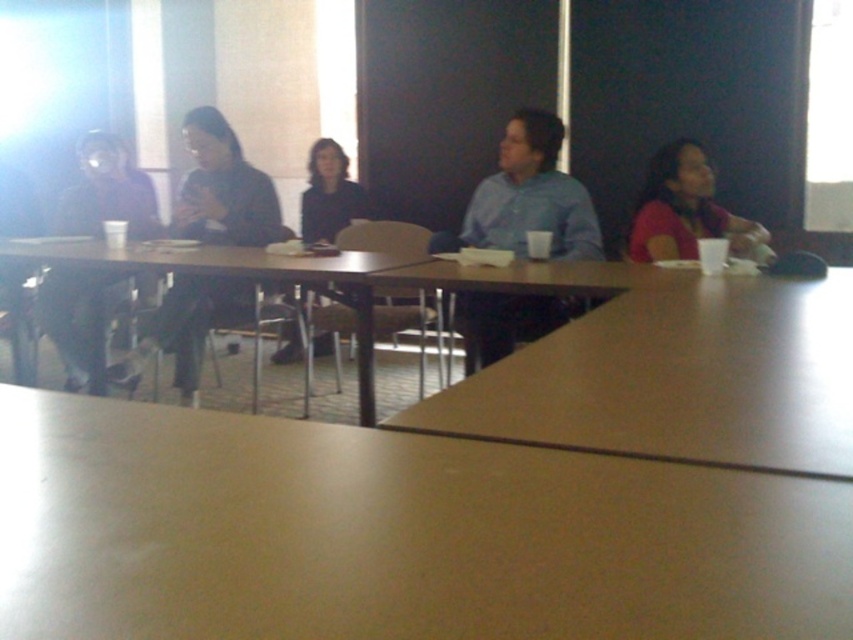
Question: Does brown wooden table at center appear on the left side of matte pink shirt at right?

Choices:
 (A) yes
 (B) no

Answer: (A)

Question: Does matte pink shirt at right come in front of matte black jacket at center?

Choices:
 (A) no
 (B) yes

Answer: (B)

Question: Which point appears closest to the camera in this image?

Choices:
 (A) (183, 552)
 (B) (292, 358)

Answer: (A)

Question: Observing the image, what is the correct spatial positioning of dark gray sweater at center in reference to brown wooden table at center?

Choices:
 (A) below
 (B) above

Answer: (B)

Question: Which point is farther to the camera?

Choices:
 (A) (628, 438)
 (B) (662, 230)
 (C) (209, 259)

Answer: (B)

Question: Which object is positioned farthest from the matte pink shirt at right?

Choices:
 (A) matte black jacket at center
 (B) smooth beige table at center

Answer: (B)